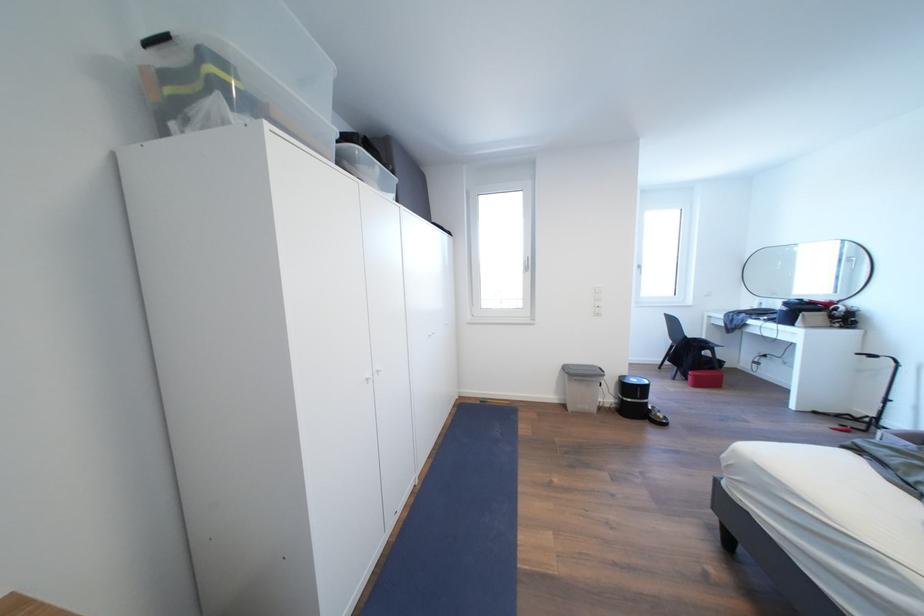
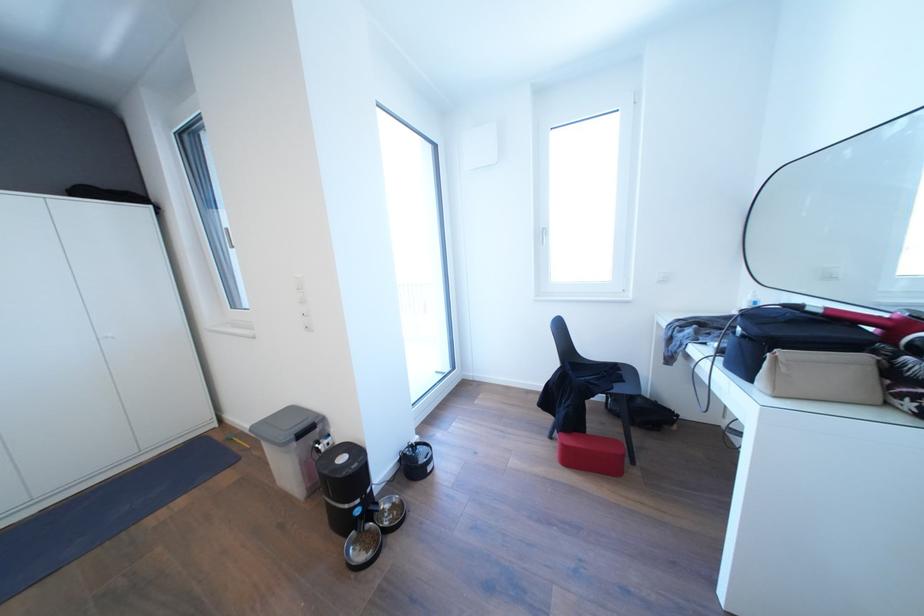
The images are taken continuously from a first-person perspective. In which direction are you moving?

The cameraman walked toward right, forward.